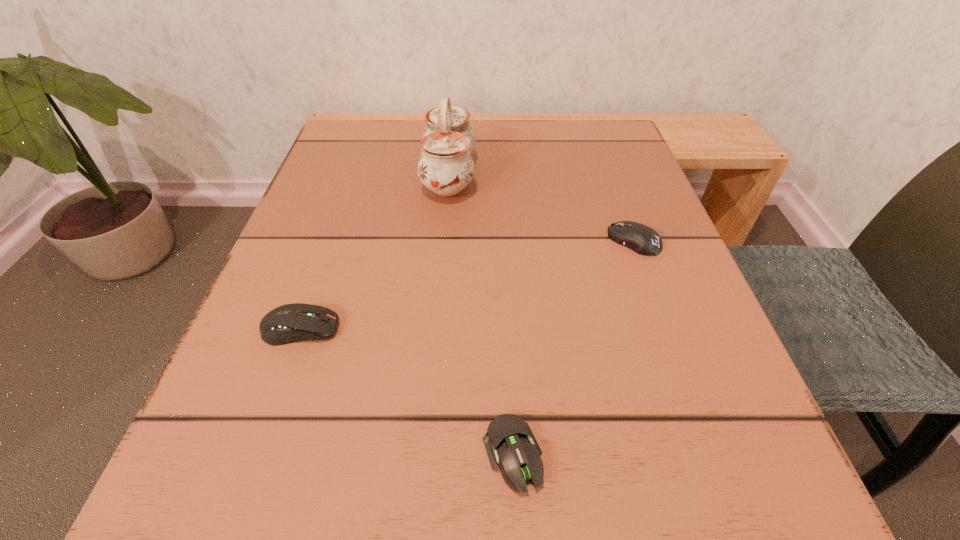
At what (x,y) coordinates should I click in order to perform the action: click on the farthest object. Please return your answer as a coordinate pair (x, y). Looking at the image, I should click on (445, 166).

Locate an element on the screen. This screenshot has width=960, height=540. the tallest object is located at coordinates click(445, 166).

Where is `the second farthest computer mouse`? This screenshot has width=960, height=540. the second farthest computer mouse is located at coordinates (x=295, y=322).

This screenshot has height=540, width=960. I want to click on the third farthest object, so click(x=295, y=322).

I want to click on the rightmost computer mouse, so click(640, 238).

Image resolution: width=960 pixels, height=540 pixels. Identify the location of the rightmost object. (640, 238).

Image resolution: width=960 pixels, height=540 pixels. I want to click on the shortest computer mouse, so pos(509,441).

The image size is (960, 540). What are the coordinates of `the second computer mouse from right to left` in the screenshot? It's located at (509, 441).

At what (x,y) coordinates should I click in order to perform the action: click on vacant region located by the handle of the third object from right to left. Please return your answer as a coordinate pair (x, y). This screenshot has width=960, height=540. Looking at the image, I should click on (512, 176).

This screenshot has height=540, width=960. I want to click on free space located on the button of the leftmost object, so click(479, 329).